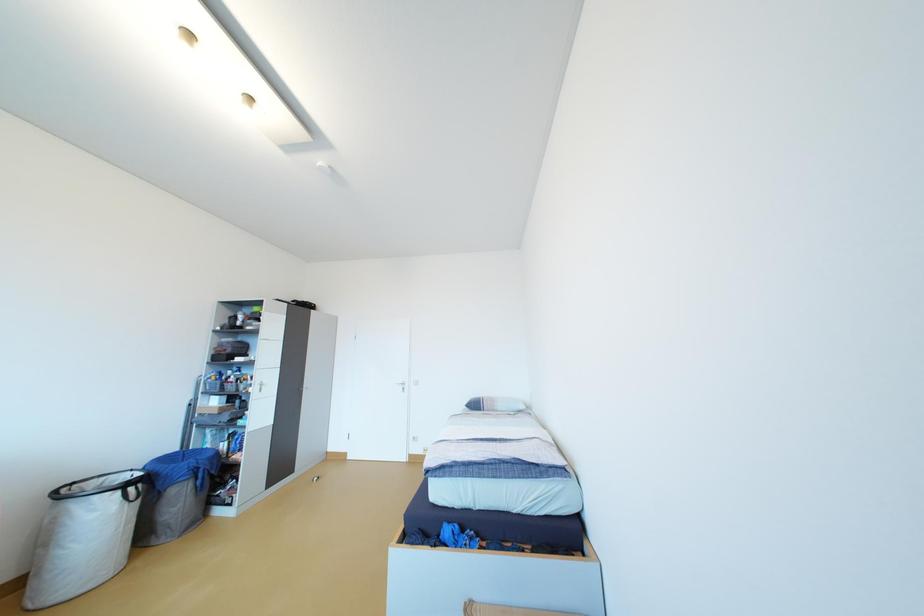
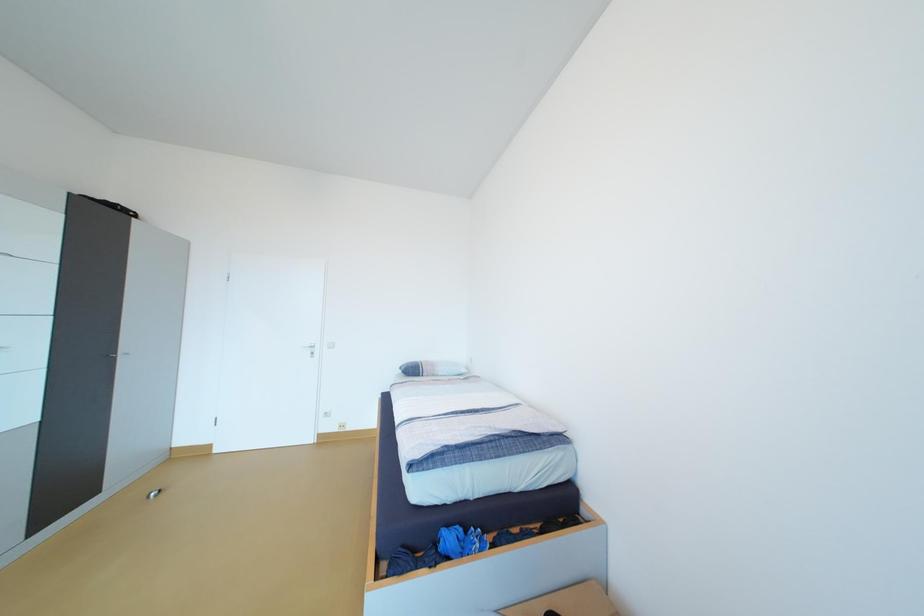
The images are taken continuously from a first-person perspective. In which direction are you moving?

The cameraman moved toward left, forward.